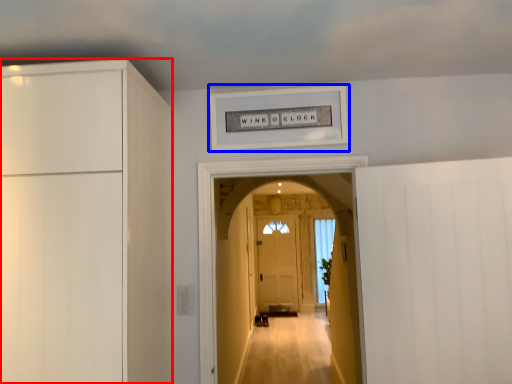
Question: Which of the following is the closest to the observer, cabinetry (highlighted by a red box) or picture frame (highlighted by a blue box)?

Choices:
 (A) cabinetry
 (B) picture frame

Answer: (A)